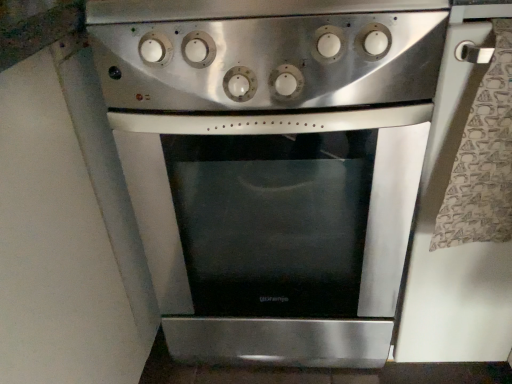
Question: From a real-world perspective, is stainless steel oven at center above or below stainless steel oven at center?

Choices:
 (A) below
 (B) above

Answer: (B)

Question: Considering the relative positions of stainless steel oven at center and stainless steel oven at center in the image provided, is stainless steel oven at center to the left or to the right of stainless steel oven at center?

Choices:
 (A) right
 (B) left

Answer: (B)

Question: Choose the correct answer: Is stainless steel oven at center inside stainless steel oven at center or outside it?

Choices:
 (A) inside
 (B) outside

Answer: (B)

Question: Is stainless steel oven at center bigger or smaller than stainless steel oven at center?

Choices:
 (A) small
 (B) big

Answer: (B)

Question: Considering their positions, is stainless steel oven at center located in front of or behind stainless steel oven at center?

Choices:
 (A) behind
 (B) front

Answer: (A)

Question: From the image's perspective, relative to stainless steel oven at center, is stainless steel oven at center above or below?

Choices:
 (A) above
 (B) below

Answer: (B)

Question: Is point (248, 119) closer or farther from the camera than point (374, 96)?

Choices:
 (A) closer
 (B) farther

Answer: (B)